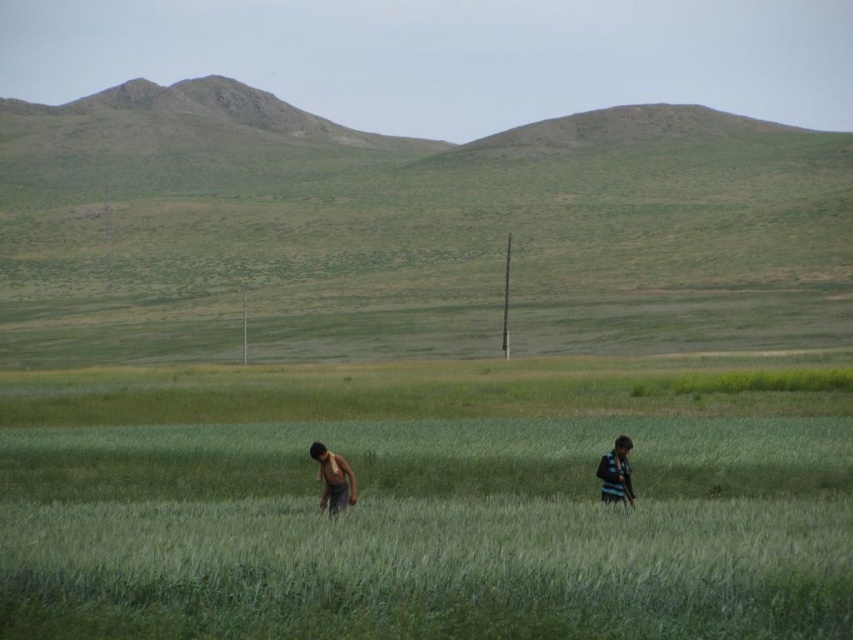
Does dark green shirt at center appear over dark brown shirt at center?

Incorrect, dark green shirt at center is not positioned above dark brown shirt at center.

Does point (610, 461) come closer to viewer compared to point (334, 468)?

Yes, point (610, 461) is closer to viewer.

Locate an element on the screen. This screenshot has width=853, height=640. dark green shirt at center is located at coordinates (334, 477).

Who is shorter, dark brown shirt at center or striped fabric shirt at right?

Standing shorter between the two is striped fabric shirt at right.

Can you confirm if dark brown shirt at center is positioned to the right of striped fabric shirt at right?

Incorrect, dark brown shirt at center is not on the right side of striped fabric shirt at right.

Where is `dark brown shirt at center`? This screenshot has height=640, width=853. dark brown shirt at center is located at coordinates coord(334,477).

Does dark green shirt at center have a lesser width compared to striped fabric shirt at right?

In fact, dark green shirt at center might be wider than striped fabric shirt at right.

The height and width of the screenshot is (640, 853). Describe the element at coordinates (334, 477) in the screenshot. I see `dark green shirt at center` at that location.

In order to click on dark green shirt at center in this screenshot , I will do `click(334, 477)`.